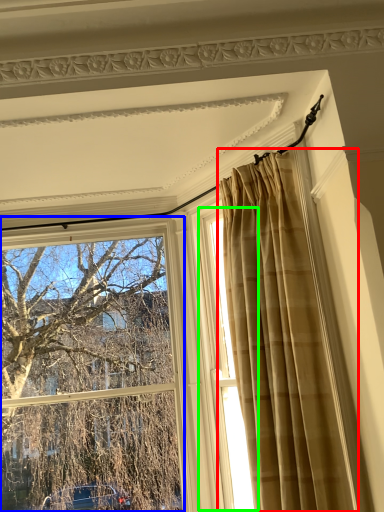
Question: Which object is the closest to the curtain (highlighted by a red box)? Choose among these: window (highlighted by a blue box) or window (highlighted by a green box).

Choices:
 (A) window
 (B) window

Answer: (B)